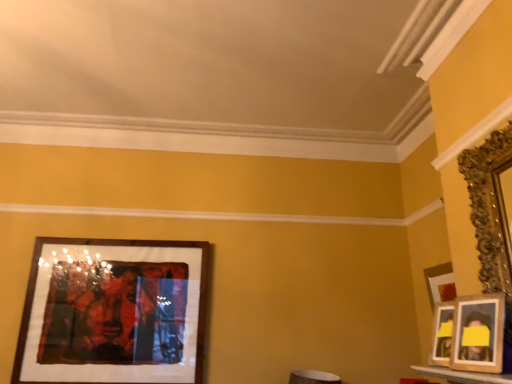
What do you see at coordinates (113, 312) in the screenshot?
I see `wooden frame at left, placed as the first picture frame when sorted from back to front` at bounding box center [113, 312].

The image size is (512, 384). I want to click on gold ornate mirror at right, the first picture frame positioned from the front, so click(x=490, y=208).

This screenshot has width=512, height=384. I want to click on wooden photo frame at right, arranged as the 2th picture frame when viewed from the back, so click(479, 333).

Looking at this image, considering the relative sizes of gold ornate mirror at right, acting as the third picture frame starting from the back, and wooden photo frame at right, the 2th picture frame positioned from the left, in the image provided, is gold ornate mirror at right, acting as the third picture frame starting from the back, taller than wooden photo frame at right, the 2th picture frame positioned from the left,?

Yes.

Is gold ornate mirror at right, acting as the third picture frame starting from the back, not near wooden photo frame at right, positioned as the 2th picture frame in right-to-left order?

No, gold ornate mirror at right, acting as the third picture frame starting from the back, is not far away from wooden photo frame at right, positioned as the 2th picture frame in right-to-left order.

Could wooden photo frame at right, the 2th picture frame positioned from the left, be considered to be inside gold ornate mirror at right, the first picture frame positioned from the front?

That's incorrect, wooden photo frame at right, the 2th picture frame positioned from the left, is not inside gold ornate mirror at right, the first picture frame positioned from the front.

Considering the points (479, 225) and (455, 319), which point is in front, point (479, 225) or point (455, 319)?

The point (455, 319) is more forward.

From a real-world perspective, is wooden photo frame at right, positioned as the 2th picture frame in right-to-left order, located beneath white glossy table at lower right?

No.

Is wooden photo frame at right, arranged as the 2th picture frame when viewed from the back, not within white glossy table at lower right?

Yes, wooden photo frame at right, arranged as the 2th picture frame when viewed from the back, is located beyond the bounds of white glossy table at lower right.

In terms of height, does wooden photo frame at right, the 2th picture frame positioned from the left, look taller or shorter compared to white glossy table at lower right?

Considering their sizes, wooden photo frame at right, the 2th picture frame positioned from the left, has more height than white glossy table at lower right.

Considering the sizes of objects white glossy table at lower right and gold ornate mirror at right, the first picture frame positioned from the front, in the image provided, who is taller, white glossy table at lower right or gold ornate mirror at right, the first picture frame positioned from the front,?

gold ornate mirror at right, the first picture frame positioned from the front, is taller.

Is point (454, 372) positioned after point (508, 153)?

Yes, it is behind point (508, 153).

Find the location of a particular element. The height and width of the screenshot is (384, 512). table below the gold ornate mirror at right, which is counted as the third picture frame, starting from the left (from the image's perspective) is located at coordinates (463, 375).

Which object is further away from the camera taking this photo, white glossy table at lower right or gold ornate mirror at right, which is counted as the third picture frame, starting from the left?

Positioned behind is gold ornate mirror at right, which is counted as the third picture frame, starting from the left.

Considering the relative positions of wooden photo frame at right, which appears as the second picture frame when viewed from the front, and gold ornate mirror at right, which is the first picture frame in right-to-left order, in the image provided, is wooden photo frame at right, which appears as the second picture frame when viewed from the front, to the left of gold ornate mirror at right, which is the first picture frame in right-to-left order, from the viewer's perspective?

Yes.

From a real-world perspective, between wooden photo frame at right, the 2th picture frame positioned from the left, and gold ornate mirror at right, which is the first picture frame in right-to-left order, who is vertically lower?

wooden photo frame at right, the 2th picture frame positioned from the left, from a real-world perspective.

Looking at the image, does wooden photo frame at right, the 2th picture frame positioned from the left, seem bigger or smaller compared to gold ornate mirror at right, acting as the third picture frame starting from the back?

Considering their sizes, wooden photo frame at right, the 2th picture frame positioned from the left, takes up less space than gold ornate mirror at right, acting as the third picture frame starting from the back.

Is wooden photo frame at right, the 2th picture frame positioned from the left, turned away from gold ornate mirror at right, which is the first picture frame in right-to-left order?

Absolutely, wooden photo frame at right, the 2th picture frame positioned from the left, is directed away from gold ornate mirror at right, which is the first picture frame in right-to-left order.

Identify the location of table in front of the wooden frame at left, placed as the first picture frame when sorted from back to front. The image size is (512, 384). (463, 375).

Consider the image. Is wooden frame at left, the 3th picture frame viewed from the front, turned away from white glossy table at lower right?

No, wooden frame at left, the 3th picture frame viewed from the front,'s orientation is not away from white glossy table at lower right.

Considering the positions of objects wooden frame at left, which is the 1th picture frame from left to right, and white glossy table at lower right in the image provided, who is more to the left, wooden frame at left, which is the 1th picture frame from left to right, or white glossy table at lower right?

From the viewer's perspective, wooden frame at left, which is the 1th picture frame from left to right, appears more on the left side.

Between wooden frame at left, placed as the first picture frame when sorted from back to front, and white glossy table at lower right, which one has smaller size?

white glossy table at lower right is smaller.

Considering the relative sizes of white glossy table at lower right and wooden frame at left, placed as the first picture frame when sorted from back to front, in the image provided, is white glossy table at lower right wider than wooden frame at left, placed as the first picture frame when sorted from back to front,?

Yes, white glossy table at lower right is wider than wooden frame at left, placed as the first picture frame when sorted from back to front.

From the image's perspective, is white glossy table at lower right located beneath wooden frame at left, placed as the 3th picture frame when sorted from right to left?

Actually, white glossy table at lower right appears above wooden frame at left, placed as the 3th picture frame when sorted from right to left, in the image.

From a real-world perspective, is white glossy table at lower right physically above wooden frame at left, placed as the 3th picture frame when sorted from right to left?

No, from a real-world perspective, white glossy table at lower right is not on top of wooden frame at left, placed as the 3th picture frame when sorted from right to left.

Where is `table above the wooden frame at left, placed as the 3th picture frame when sorted from right to left (from the image's perspective)`? Image resolution: width=512 pixels, height=384 pixels. table above the wooden frame at left, placed as the 3th picture frame when sorted from right to left (from the image's perspective) is located at coordinates (463, 375).

From the picture: What's the angular difference between wooden frame at left, the 3th picture frame viewed from the front, and wooden photo frame at right, which appears as the second picture frame when viewed from the front,'s facing directions?

There is a 74.8-degree angle between the facing directions of wooden frame at left, the 3th picture frame viewed from the front, and wooden photo frame at right, which appears as the second picture frame when viewed from the front.

Is wooden frame at left, placed as the first picture frame when sorted from back to front, oriented away from wooden photo frame at right, which appears as the second picture frame when viewed from the front?

wooden frame at left, placed as the first picture frame when sorted from back to front, does not have its back to wooden photo frame at right, which appears as the second picture frame when viewed from the front.

In the scene shown: Which of these two, wooden frame at left, placed as the first picture frame when sorted from back to front, or wooden photo frame at right, positioned as the 2th picture frame in right-to-left order, is smaller?

wooden photo frame at right, positioned as the 2th picture frame in right-to-left order, is smaller.

Based on the photo, from a real-world perspective, which is physically below, wooden frame at left, placed as the first picture frame when sorted from back to front, or wooden photo frame at right, which appears as the second picture frame when viewed from the front?

wooden photo frame at right, which appears as the second picture frame when viewed from the front, from a real-world perspective.

This screenshot has height=384, width=512. What are the coordinates of `picture frame lying in front of the wooden photo frame at right, positioned as the 2th picture frame in right-to-left order` in the screenshot? It's located at (490, 208).

At what (x,y) coordinates should I click in order to perform the action: click on table located underneath the wooden photo frame at right, which appears as the second picture frame when viewed from the front (from a real-world perspective). Please return your answer as a coordinate pair (x, y). Looking at the image, I should click on (463, 375).

Estimate the real-world distances between objects in this image. Which object is closer to wooden photo frame at right, positioned as the 2th picture frame in right-to-left order, white glossy table at lower right or gold ornate mirror at right, the first picture frame positioned from the front?

white glossy table at lower right lies closer to wooden photo frame at right, positioned as the 2th picture frame in right-to-left order, than the other object.

Which object lies nearer to the anchor point gold ornate mirror at right, the first picture frame positioned from the front, wooden frame at left, placed as the first picture frame when sorted from back to front, or wooden photo frame at right, which appears as the second picture frame when viewed from the front?

wooden photo frame at right, which appears as the second picture frame when viewed from the front, is closer to gold ornate mirror at right, the first picture frame positioned from the front.

Considering their positions, is white glossy table at lower right positioned closer to wooden photo frame at right, arranged as the 2th picture frame when viewed from the back, than wooden frame at left, the 3th picture frame viewed from the front?

white glossy table at lower right is positioned closer to the anchor wooden photo frame at right, arranged as the 2th picture frame when viewed from the back.

Looking at the image, which one is located closer to white glossy table at lower right, gold ornate mirror at right, the first picture frame positioned from the front, or wooden photo frame at right, which appears as the second picture frame when viewed from the front?

wooden photo frame at right, which appears as the second picture frame when viewed from the front, is closer to white glossy table at lower right.

Looking at the image, which one is located closer to gold ornate mirror at right, the first picture frame positioned from the front, white glossy table at lower right or wooden frame at left, placed as the first picture frame when sorted from back to front?

white glossy table at lower right is positioned closer to the anchor gold ornate mirror at right, the first picture frame positioned from the front.

From the picture: Estimate the real-world distances between objects in this image. Which object is closer to gold ornate mirror at right, which is counted as the third picture frame, starting from the left, wooden photo frame at right, positioned as the 2th picture frame in right-to-left order, or wooden frame at left, placed as the 3th picture frame when sorted from right to left?

wooden photo frame at right, positioned as the 2th picture frame in right-to-left order.

Looking at the image, which one is located further to gold ornate mirror at right, which is counted as the third picture frame, starting from the left, wooden frame at left, placed as the first picture frame when sorted from back to front, or white glossy table at lower right?

wooden frame at left, placed as the first picture frame when sorted from back to front, lies further to gold ornate mirror at right, which is counted as the third picture frame, starting from the left, than the other object.

From the picture: When comparing their distances from wooden frame at left, placed as the 3th picture frame when sorted from right to left, does wooden photo frame at right, the 2th picture frame positioned from the left, or gold ornate mirror at right, which is counted as the third picture frame, starting from the left, seem further?

The object further to wooden frame at left, placed as the 3th picture frame when sorted from right to left, is gold ornate mirror at right, which is counted as the third picture frame, starting from the left.

Where is `picture frame between wooden frame at left, the 3th picture frame viewed from the front, and white glossy table at lower right, in the horizontal direction`? The height and width of the screenshot is (384, 512). picture frame between wooden frame at left, the 3th picture frame viewed from the front, and white glossy table at lower right, in the horizontal direction is located at coordinates (479, 333).

The height and width of the screenshot is (384, 512). I want to click on table between wooden frame at left, the 3th picture frame viewed from the front, and gold ornate mirror at right, acting as the third picture frame starting from the back, from left to right, so click(x=463, y=375).

At what (x,y) coordinates should I click in order to perform the action: click on picture frame between gold ornate mirror at right, which is counted as the third picture frame, starting from the left, and white glossy table at lower right in the up-down direction. Please return your answer as a coordinate pair (x, y). This screenshot has height=384, width=512. Looking at the image, I should click on (479, 333).

In order to click on picture frame between wooden frame at left, the 3th picture frame viewed from the front, and gold ornate mirror at right, which is counted as the third picture frame, starting from the left in this screenshot , I will do `click(479, 333)`.